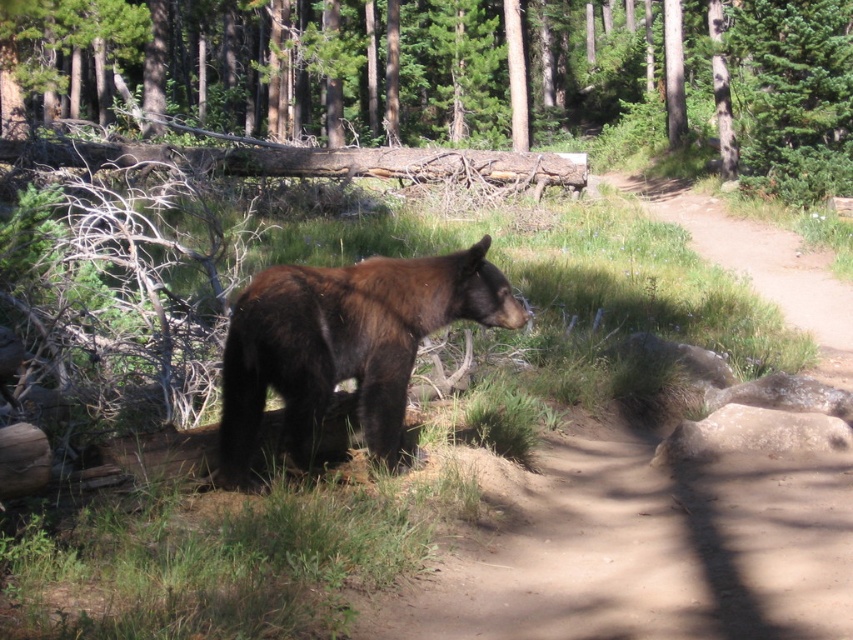
You are a hiker who needs to cross the path where the brown furry bear at center is walking. The brown rough log at center is blocking the path. Can you walk around the log on either side?

The brown rough log at center is wider than the brown furry bear at center, so the log is wider than the bear. Since the log is blocking the path, you can walk around it on either side as the log is not as wide as the path itself. However, the question does not provide information about the path width, so it is safer to assume that there is enough space to go around the log on either side.

From the picture: You are a hiker who wants to cross the path where the brown furry bear at center is walking. There is a brown rough log at center blocking your way. Can you step over the log without disturbing the bear?

The brown rough log at center is above brown furry bear at center, meaning it is elevated and positioned higher. Since the log is above the bear, it might be possible to step over it carefully without directly approaching the bear, but ensure a safe distance to avoid disturbing it.